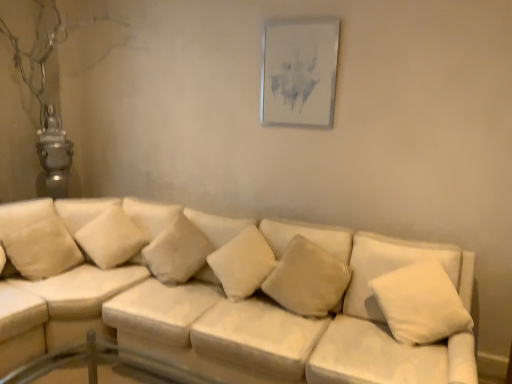
Question: Relative to metallic silver picture frame at upper center, is white soft pillow at center, the third pillow from the left, in front or behind?

Choices:
 (A) behind
 (B) front

Answer: (B)

Question: From the image's perspective, is white soft pillow at center, the fourth pillow in the right-to-left sequence, above or below metallic silver picture frame at upper center?

Choices:
 (A) above
 (B) below

Answer: (B)

Question: Considering the real-world distances, which object is farthest from the white soft pillow at upper left, positioned as the 2th pillow in left-to-right order?

Choices:
 (A) transparent glass table at lower left
 (B) white soft pillow at right, the 1th pillow from the right
 (C) metallic silver picture frame at upper center
 (D) soft beige pillow at center, the 5th pillow from the left
 (E) white fabric couch at center

Answer: (B)

Question: Which of these objects is positioned farthest from the white soft pillow at right, the 1th pillow from the right?

Choices:
 (A) white soft cushion at center, the 3th pillow when ordered from right to left
 (B) white soft cushion at left, which is the sixth pillow in right-to-left order
 (C) transparent glass table at lower left
 (D) white soft pillow at upper left, the 5th pillow positioned from the right
 (E) white fabric couch at center

Answer: (B)